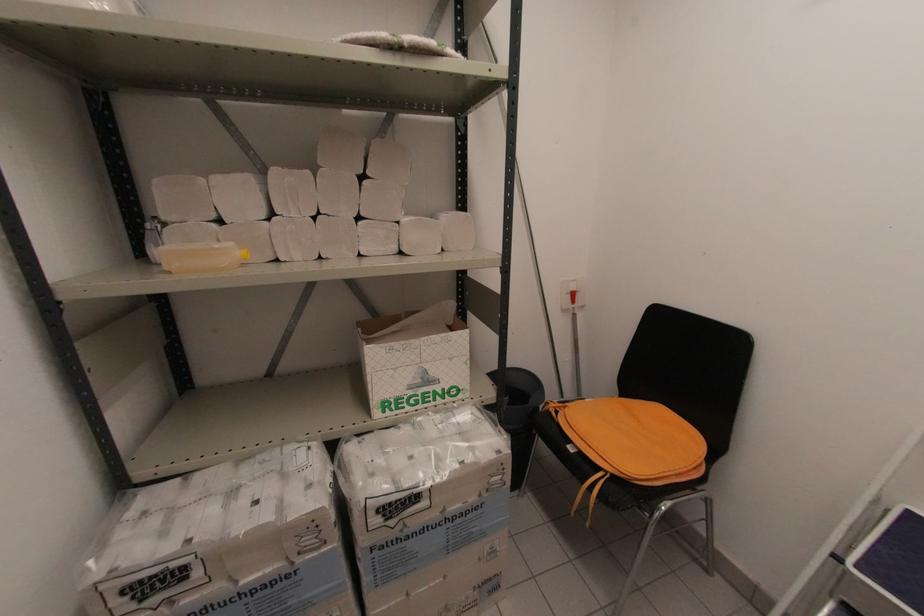
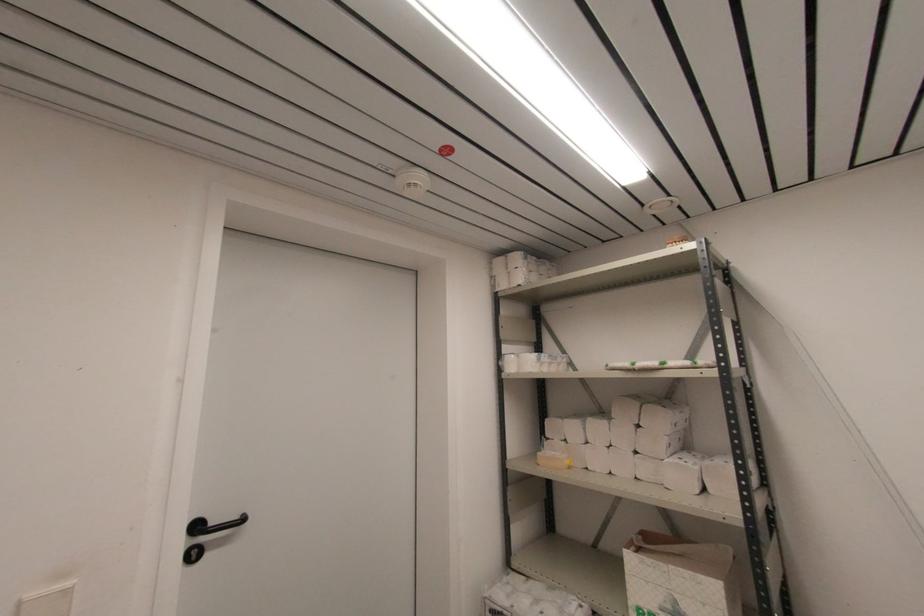
Find the pixel in the second image that matches pixel 169 273 in the first image.

(540, 464)